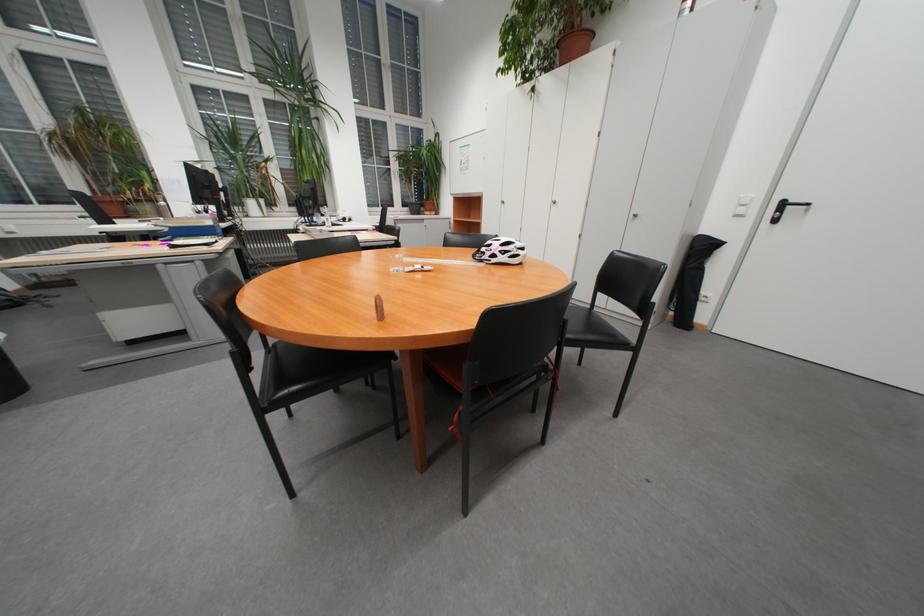
Find where to pull the black door handle. Please return your answer as a coordinate pair (x, y).

(785, 208)